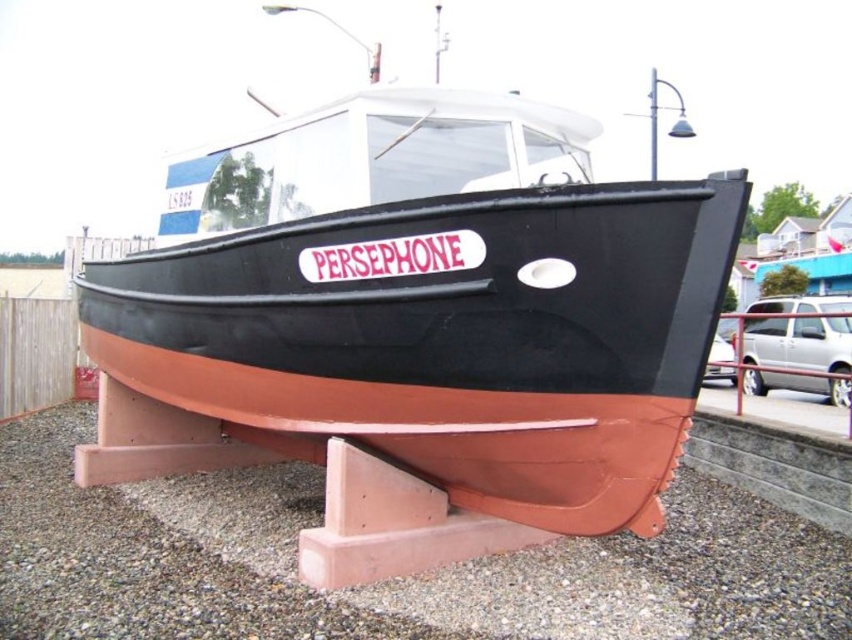
You are a delivery person trying to park your 10 feet long truck between the brown matte boat at center and the brown gravel at lower center. Can you fit your truck there?

The distance between the brown matte boat at center and the brown gravel at lower center is 9.72 feet, which is shorter than the truck length of 10 feet. Therefore, the truck cannot fit between them.

You are standing in front of the boat named PERSEPHONE. You need to determine if the brown matte boat at center can be lowered onto the brown gravel at lower center without any part of it touching the ground. Can it?

The brown matte boat at center is taller than brown gravel at lower center, so it cannot be lowered onto the gravel without part of it touching the ground.

You are a visitor at a boat exhibition and want to take a photo of the brown matte boat at center without any obstructions. Considering the size difference between the boat and the brown gravel at lower center, which object should you focus on to ensure the boat is the main subject?

The brown matte boat at center is larger than the brown gravel at lower center, so focusing on the boat will make it the main subject in your photo.